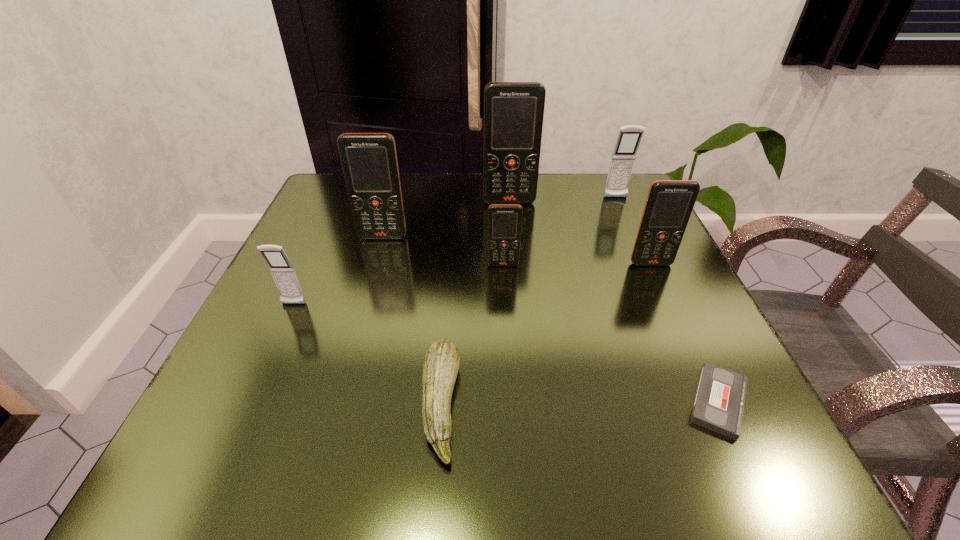
Locate an element on the screen. vacant space situated 0.290m on the back of the videotape is located at coordinates (648, 251).

Identify the location of zucchini at the near edge. The image size is (960, 540). (441, 364).

The height and width of the screenshot is (540, 960). I want to click on videotape located at the near edge, so click(719, 403).

Find the location of a particular element. The width and height of the screenshot is (960, 540). videotape at the right edge is located at coordinates (719, 403).

Identify the location of object present at the far right corner. This screenshot has height=540, width=960. (624, 154).

Where is `object that is at the near right corner`? This screenshot has width=960, height=540. object that is at the near right corner is located at coordinates (719, 403).

In the image, there is a desktop. Where is `vacant space at the far edge`? vacant space at the far edge is located at coordinates (564, 183).

Find the location of `free space at the near edge`. free space at the near edge is located at coordinates (581, 449).

At what (x,y) coordinates should I click in order to perform the action: click on blank space at the left edge. Please return your answer as a coordinate pair (x, y). The width and height of the screenshot is (960, 540). Looking at the image, I should click on (252, 358).

Image resolution: width=960 pixels, height=540 pixels. Identify the location of vacant space at the right edge. (622, 357).